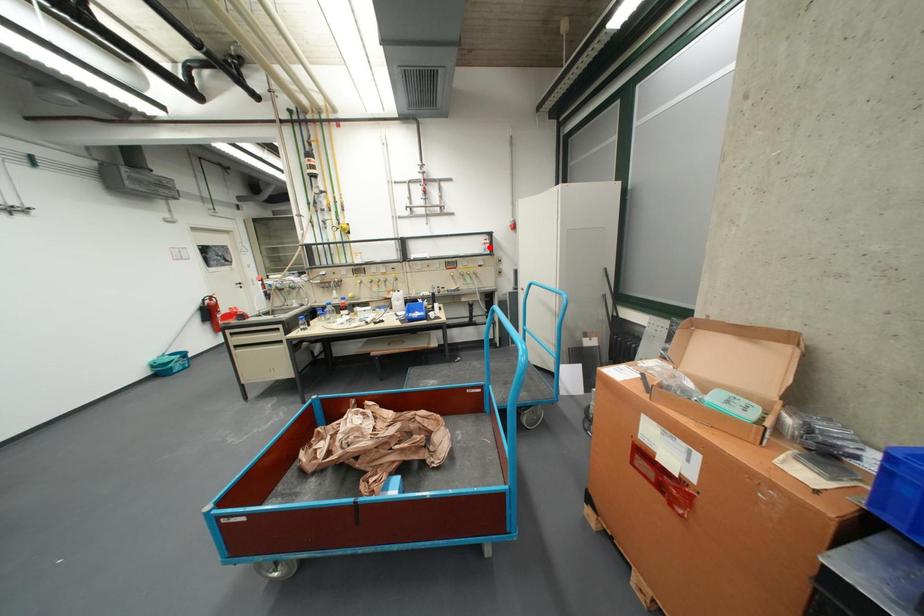
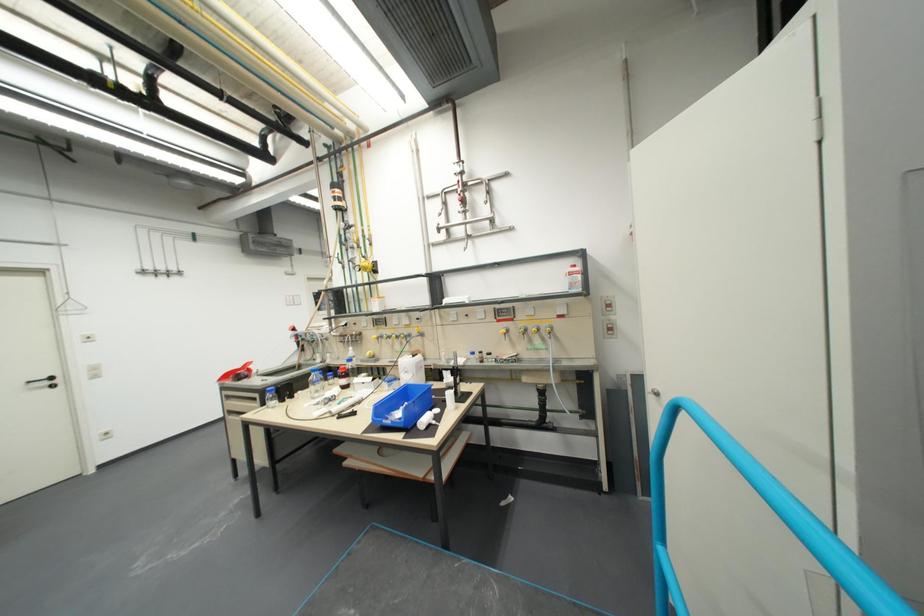
The point at the highlighted location is marked in the first image. Where is the corresponding point in the second image?

(568, 280)